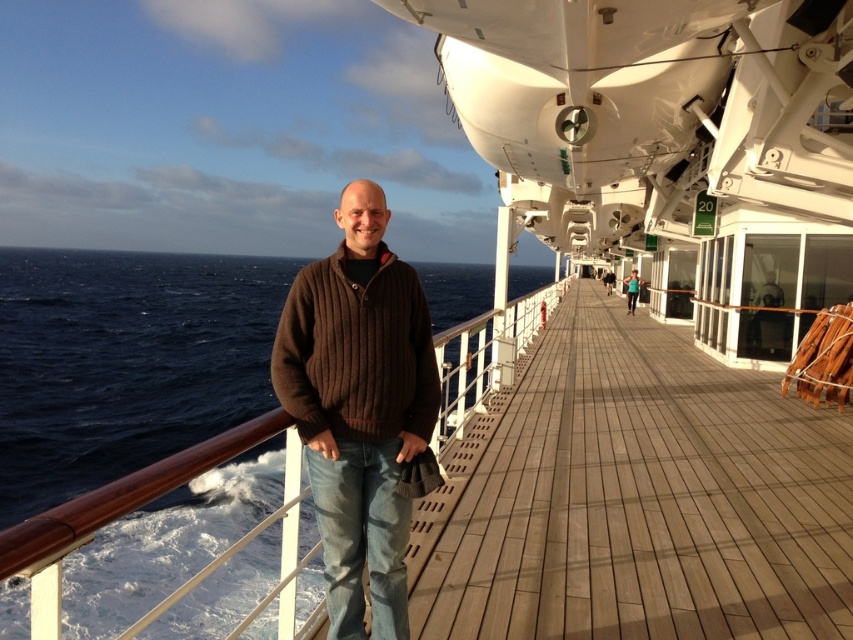
Question: Is brown ribbed sweater at center below brown knitted sweater at center?

Choices:
 (A) no
 (B) yes

Answer: (B)

Question: Estimate the real-world distances between objects in this image. Which object is farther from the matte brown sweater at center?

Choices:
 (A) brown ribbed sweater at center
 (B) brown knitted sweater at center

Answer: (A)

Question: Can you confirm if brown knitted sweater at center is positioned above matte brown sweater at center?

Choices:
 (A) yes
 (B) no

Answer: (B)

Question: Based on their relative distances, which object is farther from the brown knitted sweater at center?

Choices:
 (A) matte brown sweater at center
 (B) brown ribbed sweater at center

Answer: (A)

Question: Estimate the real-world distances between objects in this image. Which object is farther from the matte brown sweater at center?

Choices:
 (A) brown knitted sweater at center
 (B) brown ribbed sweater at center

Answer: (B)

Question: Does brown ribbed sweater at center have a larger size compared to brown knitted sweater at center?

Choices:
 (A) yes
 (B) no

Answer: (A)